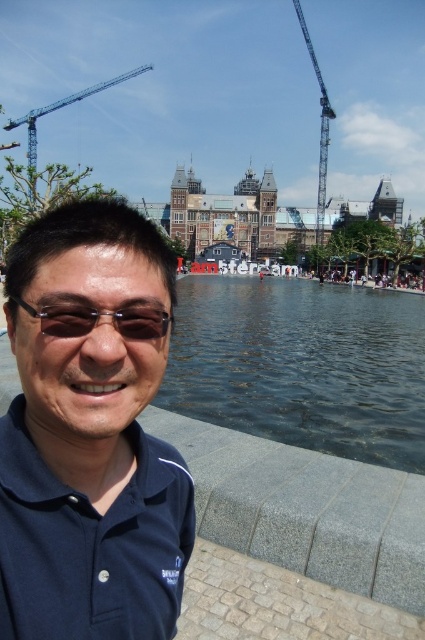
Question: Which object is the farthest from the sunglasses at center?

Choices:
 (A) dark blue shirt at center
 (B) blue metallic crane at upper left

Answer: (B)

Question: Which of these objects is positioned closest to the dark blue shirt at center?

Choices:
 (A) sunglasses at center
 (B) blue metallic crane at upper left
 (C) metallic blue crane at upper right
 (D) clear water at center

Answer: (A)

Question: In this image, where is clear water at center located relative to metallic blue crane at upper right?

Choices:
 (A) below
 (B) above

Answer: (A)

Question: Is clear water at center to the right of metallic blue crane at upper right from the viewer's perspective?

Choices:
 (A) no
 (B) yes

Answer: (A)

Question: Is dark blue shirt at center to the right of sunglasses at center from the viewer's perspective?

Choices:
 (A) yes
 (B) no

Answer: (A)

Question: Estimate the real-world distances between objects in this image. Which object is closer to the dark blue shirt at center?

Choices:
 (A) metallic blue crane at upper right
 (B) sunglasses at center
 (C) clear water at center

Answer: (B)